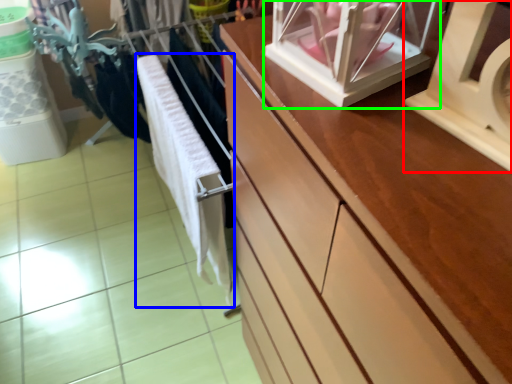
Question: Which object is the farthest from wide (highlighted by a red box)? Choose among these: baby clothe (highlighted by a blue box) or glass box (highlighted by a green box).

Choices:
 (A) baby clothe
 (B) glass box

Answer: (A)